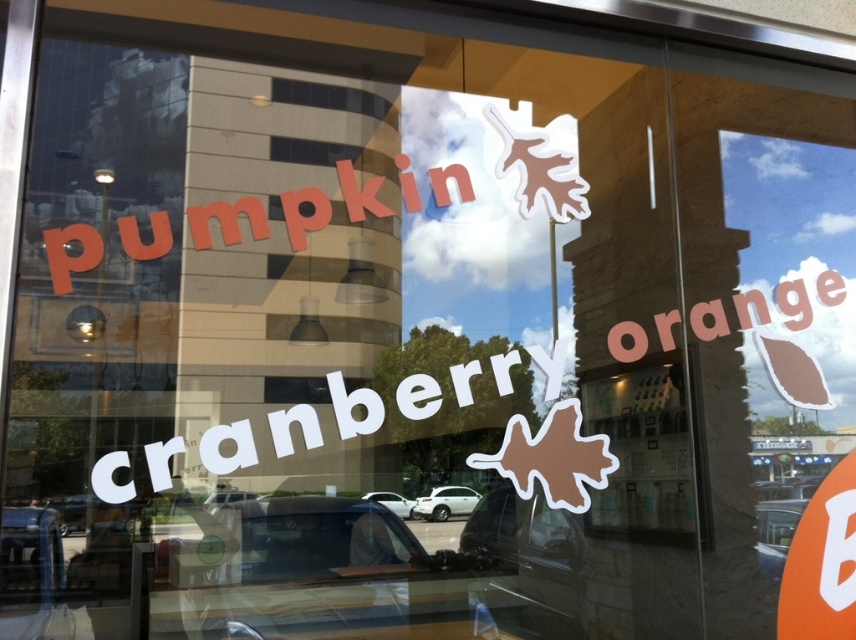
Which of these two, pumpkin matte lettering at upper left or orange matte leaf at upper right, stands shorter?

orange matte leaf at upper right is shorter.

Which is above, pumpkin matte lettering at upper left or orange matte leaf at upper right?

Positioned higher is pumpkin matte lettering at upper left.

Identify the location of pumpkin matte lettering at upper left. (70, 253).

Does point (339, 388) come in front of point (402, 193)?

That is True.

The image size is (856, 640). Describe the element at coordinates (354, 406) in the screenshot. I see `white matte cranberry at center` at that location.

Is point (111, 492) behind point (236, 230)?

No, (111, 492) is closer to viewer.

Locate an element on the screen. This screenshot has height=640, width=856. white matte cranberry at center is located at coordinates (354, 406).

Can you confirm if white matte cranberry at center is thinner than orange matte leaf at upper right?

In fact, white matte cranberry at center might be wider than orange matte leaf at upper right.

Between point (417, 378) and point (801, 291), which one is positioned behind?

Point (801, 291)

Does point (401, 408) lie in front of point (634, 358)?

Yes, point (401, 408) is in front of point (634, 358).

This screenshot has height=640, width=856. What are the coordinates of `white matte cranberry at center` in the screenshot? It's located at [x=354, y=406].